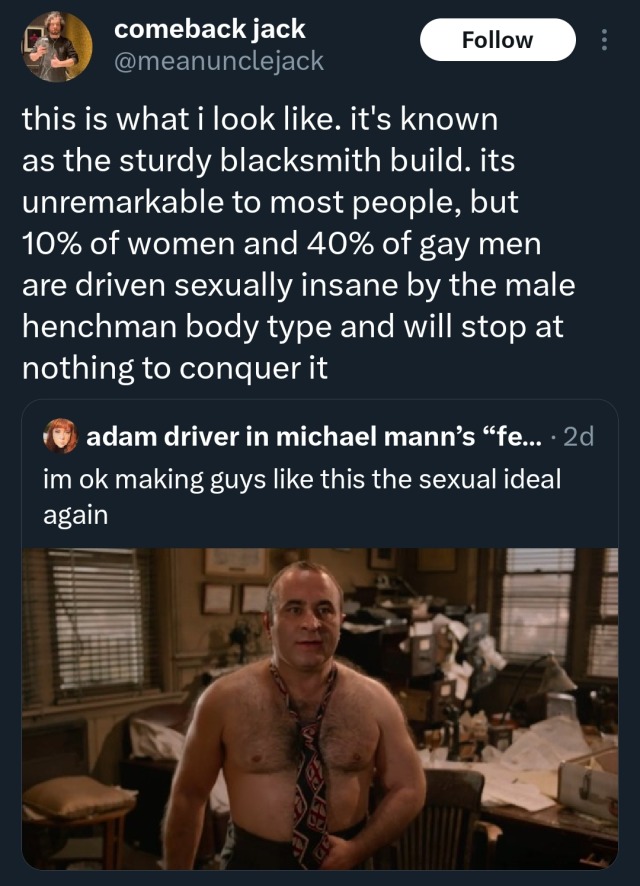
Where is `window`? The height and width of the screenshot is (886, 640). window is located at coordinates (99, 633).